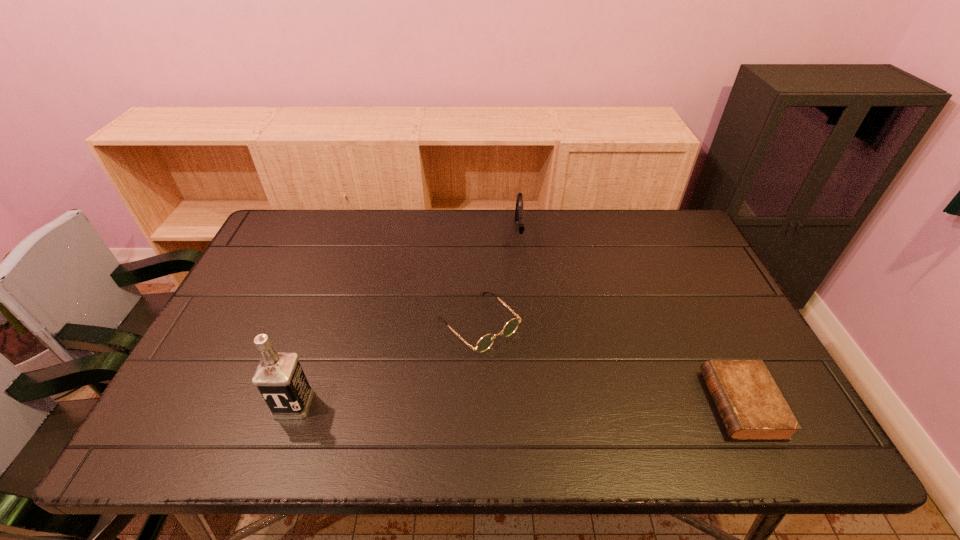
Find the location of a particular element. The height and width of the screenshot is (540, 960). vodka is located at coordinates (279, 377).

The width and height of the screenshot is (960, 540). Find the location of `the tallest object`. the tallest object is located at coordinates (279, 377).

Find the location of a particular element. the shortest object is located at coordinates (750, 404).

At what (x,y) coordinates should I click in order to perform the action: click on the rightmost object. Please return your answer as a coordinate pair (x, y). This screenshot has height=540, width=960. Looking at the image, I should click on (750, 404).

Locate an element on the screen. The image size is (960, 540). the third object from right to left is located at coordinates click(485, 342).

This screenshot has height=540, width=960. In order to click on spectacles in this screenshot , I will do `click(485, 342)`.

In order to click on the farthest object in this screenshot , I will do `click(519, 213)`.

Find the location of a particular element. the third shortest object is located at coordinates (519, 213).

You are a GUI agent. You are given a task and a screenshot of the screen. Output one action in this format:
    pyautogui.click(x=<x>, y=<y>)
    Task: Click on the vacant space located 0.300m on the spine side of the diary
    Image resolution: width=960 pixels, height=540 pixels.
    Given the screenshot: What is the action you would take?
    pyautogui.click(x=581, y=404)

At what (x,y) coordinates should I click in order to perform the action: click on vacant area situated 0.200m on the spine side of the diary. Please return your answer as a coordinate pair (x, y). Looking at the image, I should click on (625, 404).